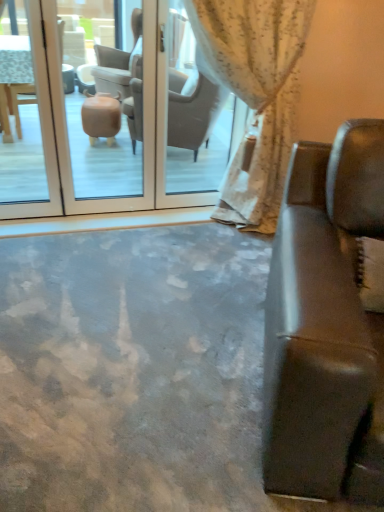
Question: Considering the positions of point (61, 193) and point (342, 152), is point (61, 193) closer or farther from the camera than point (342, 152)?

Choices:
 (A) closer
 (B) farther

Answer: (B)

Question: Is transparent glass door at center bigger or smaller than leather couch at right?

Choices:
 (A) small
 (B) big

Answer: (A)

Question: Estimate the real-world distances between objects in this image. Which object is closer to the white floral fabric curtain at upper center?

Choices:
 (A) transparent glass door at center
 (B) leather couch at right

Answer: (A)

Question: Which object is positioned farthest from the transparent glass door at center?

Choices:
 (A) white floral fabric curtain at upper center
 (B) leather couch at right

Answer: (B)